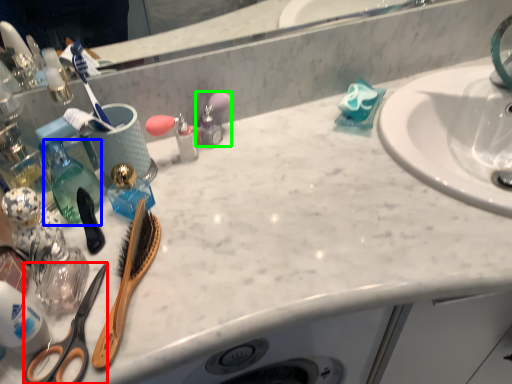
Question: Which object is positioned closest to scissors (highlighted by a red box)? Select from bottle (highlighted by a blue box) and toiletry (highlighted by a green box).

Choices:
 (A) bottle
 (B) toiletry

Answer: (A)